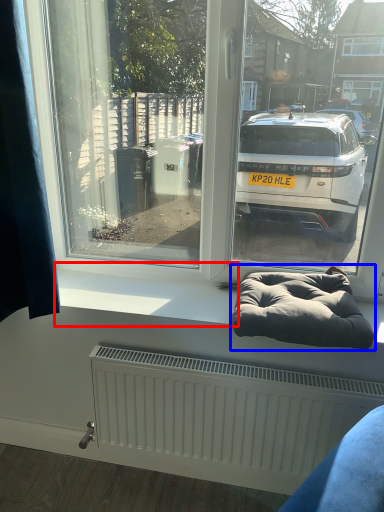
Question: Among these objects, which one is farthest to the camera, window sill (highlighted by a red box) or bean bag chair (highlighted by a blue box)?

Choices:
 (A) window sill
 (B) bean bag chair

Answer: (A)